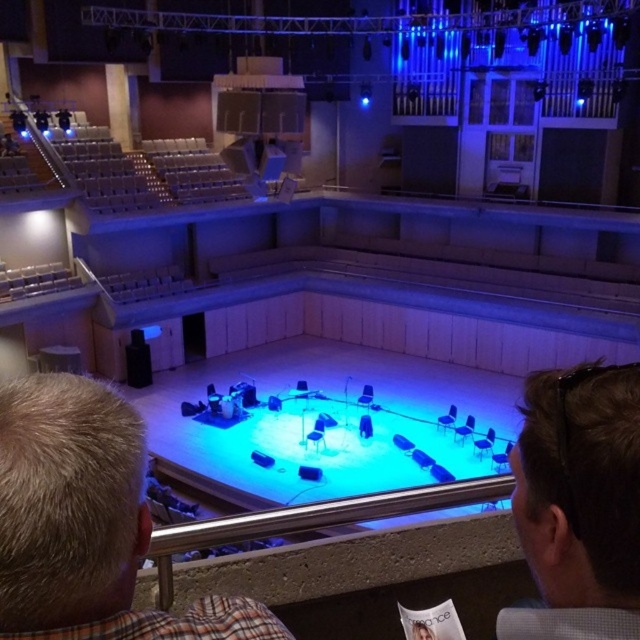
Question: Is blonde hair at center below light brown hair at lower right?

Choices:
 (A) yes
 (B) no

Answer: (A)

Question: Which point is closer to the camera?

Choices:
 (A) light brown hair at lower right
 (B) blonde hair at center

Answer: (B)

Question: Is blonde hair at center thinner than light brown hair at lower right?

Choices:
 (A) yes
 (B) no

Answer: (B)

Question: Can you confirm if blonde hair at center is thinner than light brown hair at lower right?

Choices:
 (A) no
 (B) yes

Answer: (A)